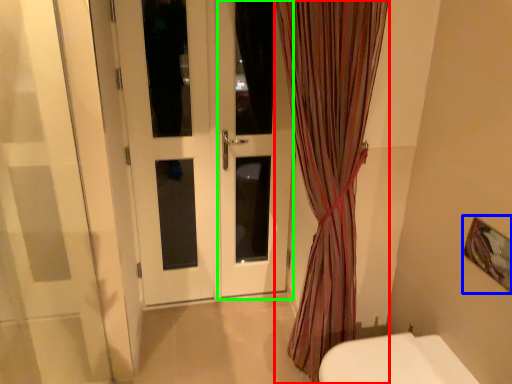
Question: Which object is the farthest from curtain (highlighted by a red box)? Choose among these: picture frame (highlighted by a blue box) or screen door (highlighted by a green box).

Choices:
 (A) picture frame
 (B) screen door

Answer: (A)